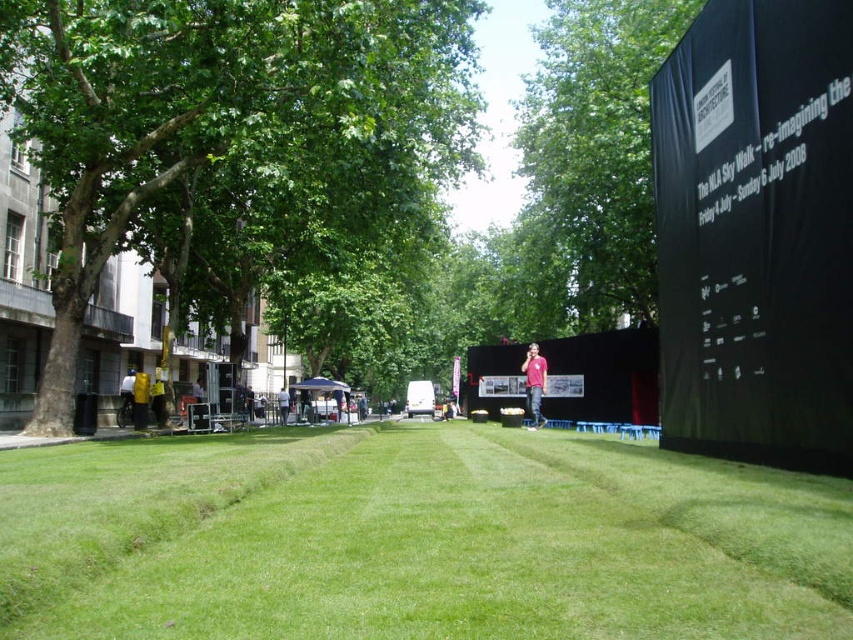
Which is in front, point (368, 532) or point (252, 164)?

Point (368, 532) is more forward.

Measure the distance from green grass at center to green leafy tree at left.

green grass at center and green leafy tree at left are 8.44 meters apart from each other.

The height and width of the screenshot is (640, 853). I want to click on green grass at center, so click(415, 540).

Who is positioned more to the left, green leafy tree at left or green leafy tree at upper center?

green leafy tree at left is more to the left.

Between point (223, 128) and point (589, 128), which one is positioned in front?

Point (223, 128)

Describe the element at coordinates (229, 136) in the screenshot. I see `green leafy tree at left` at that location.

Locate an element on the screen. green leafy tree at left is located at coordinates (229, 136).

Can you confirm if green grass at center is bigger than green leafy tree at upper center?

No.

You are a GUI agent. You are given a task and a screenshot of the screen. Output one action in this format:
    pyautogui.click(x=<x>, y=<y>)
    Task: Click on the green grass at center
    This screenshot has height=640, width=853.
    Given the screenshot: What is the action you would take?
    pyautogui.click(x=415, y=540)

Between point (253, 532) and point (541, 144), which one is positioned behind?

Point (541, 144)

This screenshot has height=640, width=853. What are the coordinates of `green grass at center` in the screenshot? It's located at (415, 540).